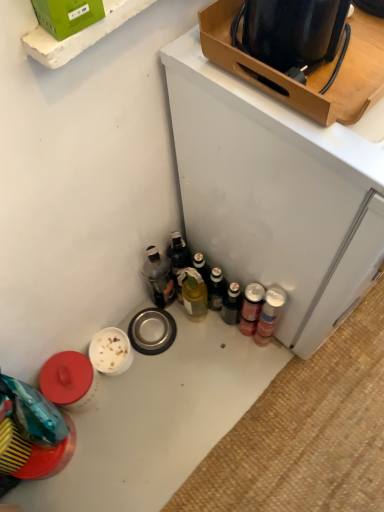
This screenshot has width=384, height=512. What are the coordinates of `vacant space in front of translucent plastic bottle at center, placed as the 2th bottle when sorted from left to right` in the screenshot? It's located at (195, 333).